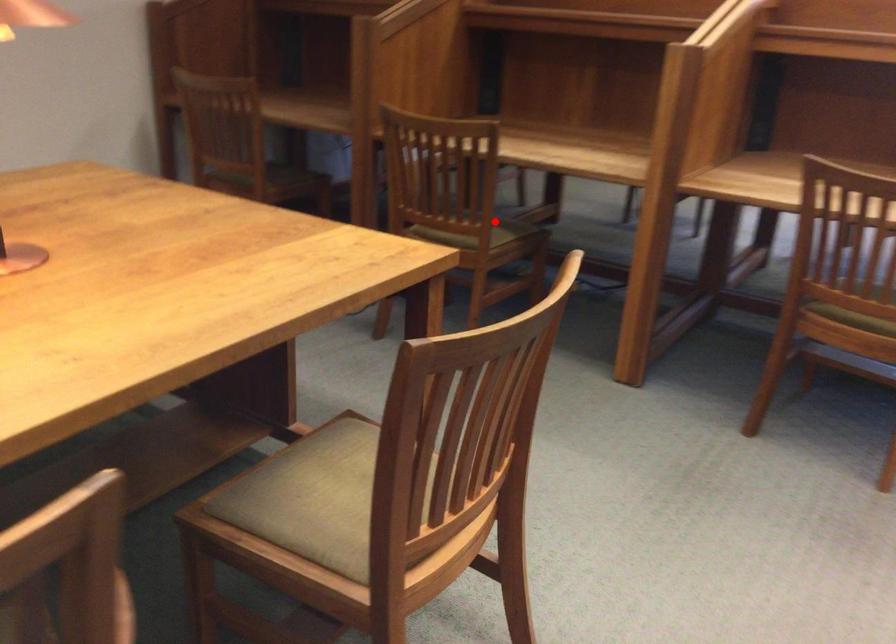
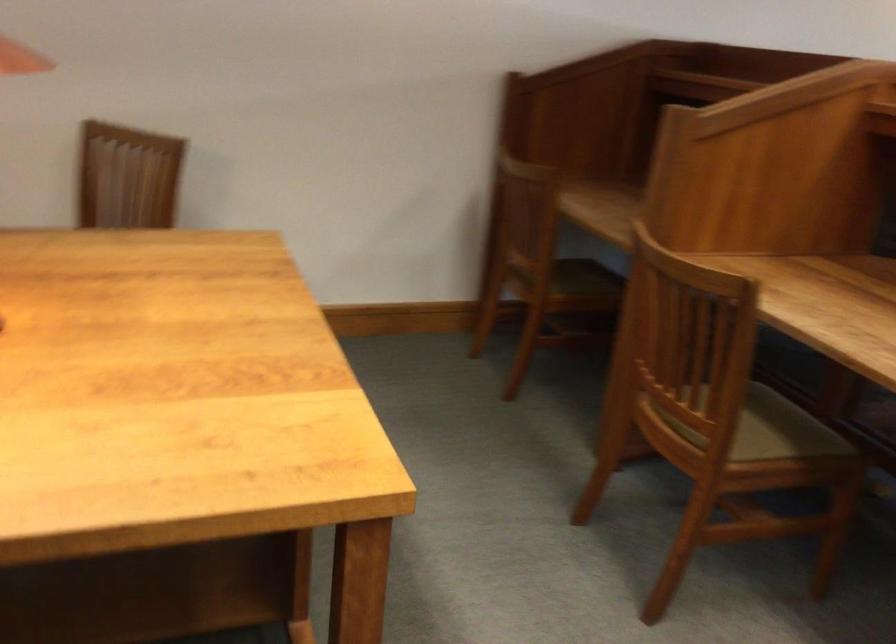
In the second image, find the point that corresponds to the highlighted location in the first image.

(765, 428)